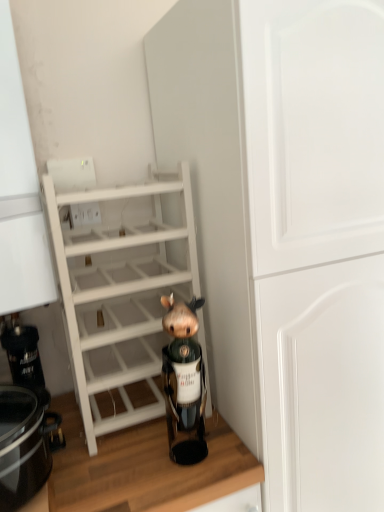
What are the coordinates of `free area behind brown matte figurine at center` in the screenshot? It's located at (165, 423).